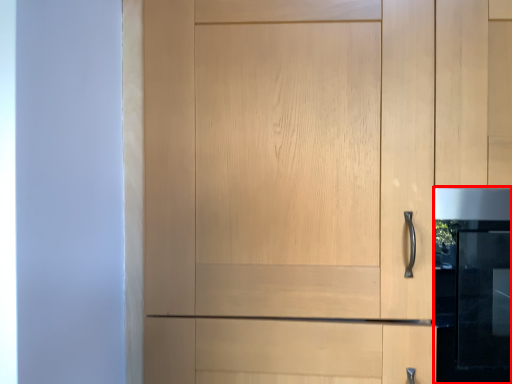
Question: From the image's perspective, considering the relative positions of oven (annotated by the red box) and cupboard in the image provided, where is oven (annotated by the red box) located with respect to the staircase?

Choices:
 (A) above
 (B) below

Answer: (B)